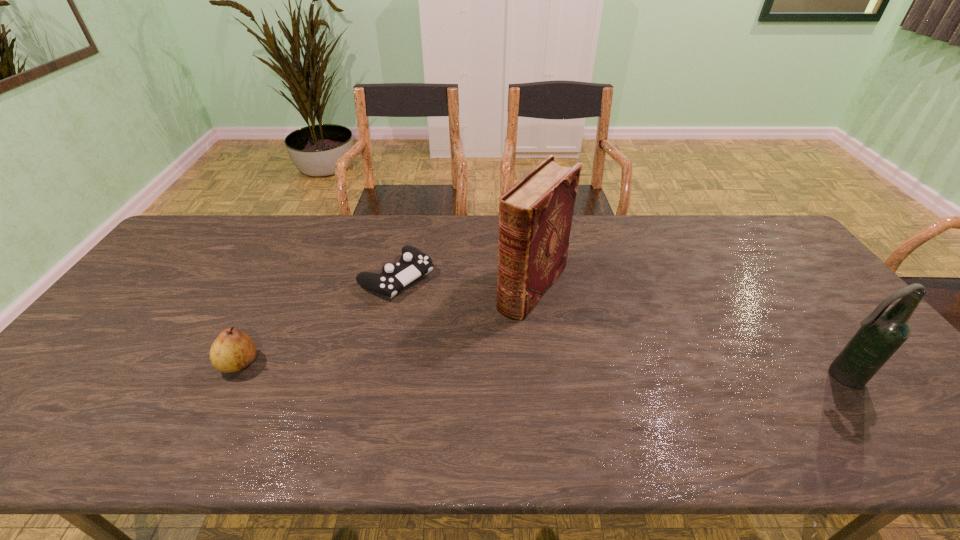
Locate an element on the screen. This screenshot has width=960, height=540. object that is positioned at the near right corner is located at coordinates (882, 333).

This screenshot has height=540, width=960. In the image, there is a desktop. In order to click on vacant space at the far edge in this screenshot , I will do `click(649, 219)`.

The image size is (960, 540). In the image, there is a desktop. Find the location of `vacant space at the near edge`. vacant space at the near edge is located at coordinates (162, 387).

Find the location of a particular element. vacant space at the left edge of the desktop is located at coordinates click(129, 296).

Image resolution: width=960 pixels, height=540 pixels. I want to click on free location at the right edge of the desktop, so click(759, 271).

At what (x,y) coordinates should I click in order to perform the action: click on free spot at the far left corner of the desktop. Please return your answer as a coordinate pair (x, y). Image resolution: width=960 pixels, height=540 pixels. Looking at the image, I should click on (212, 246).

The width and height of the screenshot is (960, 540). I want to click on blank region between the pear and the second object from right to left, so click(x=386, y=325).

What are the coordinates of `free space between the second object from right to left and the pear` in the screenshot? It's located at (386, 325).

The height and width of the screenshot is (540, 960). I want to click on free space between the second object from left to right and the third object from left to right, so click(465, 282).

Find the location of a particular element. vacant space that is in between the rightmost object and the third tallest object is located at coordinates (540, 370).